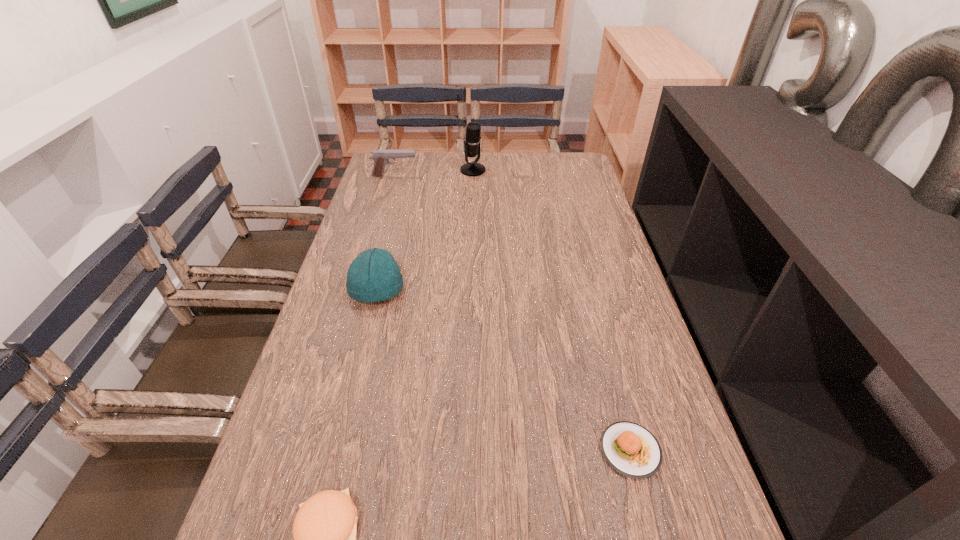
The height and width of the screenshot is (540, 960). What are the coordinates of `microphone at the far edge` in the screenshot? It's located at (472, 140).

This screenshot has height=540, width=960. Identify the location of pistol present at the far edge. (381, 157).

The image size is (960, 540). Find the location of `beanie located at the left edge`. beanie located at the left edge is located at coordinates (373, 276).

Where is `pistol that is at the left edge`? The width and height of the screenshot is (960, 540). pistol that is at the left edge is located at coordinates (381, 157).

Where is `object that is at the right edge`? object that is at the right edge is located at coordinates tap(632, 450).

Locate an element on the screen. object that is at the far left corner is located at coordinates (381, 157).

Where is `free space at the far edge`? free space at the far edge is located at coordinates (534, 164).

This screenshot has height=540, width=960. In the image, there is a desktop. What are the coordinates of `free space at the left edge` in the screenshot? It's located at (303, 400).

In the image, there is a desktop. At what (x,y) coordinates should I click in order to perform the action: click on vacant space at the right edge. Please return your answer as a coordinate pair (x, y). The image size is (960, 540). Looking at the image, I should click on (581, 185).

Image resolution: width=960 pixels, height=540 pixels. I want to click on vacant space at the far left corner of the desktop, so click(x=396, y=176).